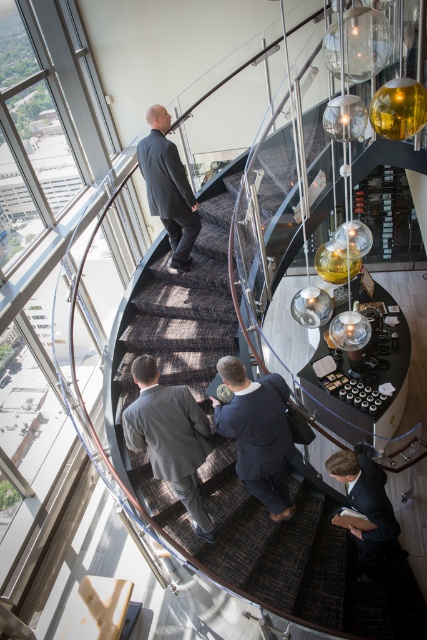
You are standing at the base of the spiral staircase and want to greet the dark gray suit at center and the dark gray suit at upper center. Which one should you approach first if you want to meet the person closer to the top of the staircase?

You should approach the dark gray suit at upper center first because it is located higher up the staircase compared to the dark gray suit at center, which is positioned below it.

You are standing at the bottom of the brown carpeted stairs at center and want to reach the dark blue suit at center. Which direction should you move to get closer to the suit?

The brown carpeted stairs at center is taller than dark blue suit at center. To get closer to the dark blue suit at center, you should move downward since the stairs are elevated above the suit.

You are standing at the base of the staircase and want to reach the dark blue suit at center. Which direction should you move relative to the brown carpeted stairs at center?

To reach the dark blue suit at center, you should move to the right of the brown carpeted stairs at center since the stairs are to the left of the suit.